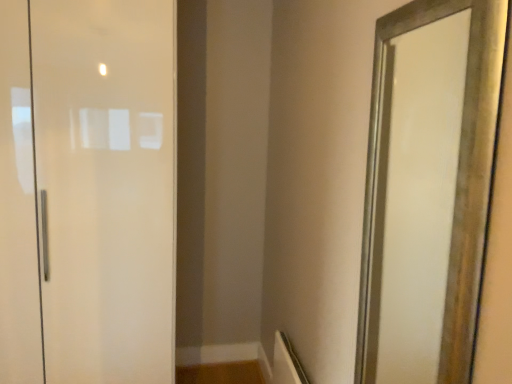
What do you see at coordinates (428, 189) in the screenshot?
I see `gold-framed mirror at right` at bounding box center [428, 189].

Find the location of a particular element. gold-framed mirror at right is located at coordinates (428, 189).

Measure the distance between gold-framed mirror at right and camera.

6.74 feet.

This screenshot has height=384, width=512. What do you see at coordinates (106, 187) in the screenshot? I see `matte white door at left` at bounding box center [106, 187].

I want to click on matte white door at left, so tap(106, 187).

Find the location of a particular element. gold-framed mirror at right is located at coordinates click(x=428, y=189).

Based on their positions, is gold-framed mirror at right located to the left or right of matte white door at left?

From the image, it's evident that gold-framed mirror at right is to the right of matte white door at left.

Which is behind, gold-framed mirror at right or matte white door at left?

Positioned behind is matte white door at left.

Considering the points (408, 324) and (121, 70), which point is behind, point (408, 324) or point (121, 70)?

The point (408, 324) is farther from the camera.

From the image's perspective, is gold-framed mirror at right on top of matte white door at left?

No.

From a real-world perspective, who is located lower, gold-framed mirror at right or matte white door at left?

matte white door at left is physically lower.

In terms of width, does gold-framed mirror at right look wider or thinner when compared to matte white door at left?

gold-framed mirror at right is thinner than matte white door at left.

Considering the sizes of gold-framed mirror at right and matte white door at left in the image, is gold-framed mirror at right taller or shorter than matte white door at left?

Clearly, gold-framed mirror at right is shorter compared to matte white door at left.

Between gold-framed mirror at right and matte white door at left, which one has smaller size?

With smaller size is gold-framed mirror at right.

Can matte white door at left be found inside gold-framed mirror at right?

No, matte white door at left is not surrounded by gold-framed mirror at right.

Is gold-framed mirror at right touching matte white door at left?

No, gold-framed mirror at right is not beside matte white door at left.

Is matte white door at left at the back of gold-framed mirror at right?

No, gold-framed mirror at right's orientation is not away from matte white door at left.

How different are the orientations of gold-framed mirror at right and matte white door at left in degrees?

The facing directions of gold-framed mirror at right and matte white door at left are 88.7 degrees apart.

How much distance is there between gold-framed mirror at right and matte white door at left?

gold-framed mirror at right is 4.27 feet from matte white door at left.

What are the coordinates of `door lying on the left of gold-framed mirror at right` in the screenshot? It's located at (106, 187).

Is matte white door at left to the left or to the right of gold-framed mirror at right in the image?

Clearly, matte white door at left is on the left of gold-framed mirror at right in the image.

Who is more distant, matte white door at left or gold-framed mirror at right?

matte white door at left is behind.

Consider the image. Which is farther, (170, 266) or (429, 322)?

The point (429, 322) is more distant.

From the image's perspective, which one is positioned higher, matte white door at left or gold-framed mirror at right?

From the image's view, matte white door at left is above.

From a real-world perspective, is matte white door at left positioned over gold-framed mirror at right based on gravity?

No, from a real-world perspective, matte white door at left is not on top of gold-framed mirror at right.

Between matte white door at left and gold-framed mirror at right, which one has smaller width?

With smaller width is gold-framed mirror at right.

Between matte white door at left and gold-framed mirror at right, which one has more height?

matte white door at left is taller.

Does matte white door at left have a smaller size compared to gold-framed mirror at right?

No.

Is gold-framed mirror at right located within matte white door at left?

No, gold-framed mirror at right is not inside matte white door at left.

Is matte white door at left directly adjacent to gold-framed mirror at right?

matte white door at left and gold-framed mirror at right are clearly separated.

Is matte white door at left aimed at gold-framed mirror at right?

No.

How many degrees apart are the facing directions of matte white door at left and gold-framed mirror at right?

matte white door at left and gold-framed mirror at right are facing 88.7 degrees away from each other.

Where is `door below the gold-framed mirror at right (from a real-world perspective)`? door below the gold-framed mirror at right (from a real-world perspective) is located at coordinates click(106, 187).

The image size is (512, 384). I want to click on door behind the gold-framed mirror at right, so click(x=106, y=187).

Find the location of a particular element. The image size is (512, 384). mirror that is in front of the matte white door at left is located at coordinates (428, 189).